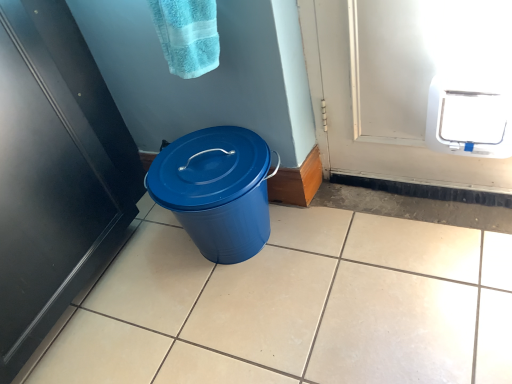
I want to click on free space on the front side of blue plastic trash can at center, so click(x=257, y=321).